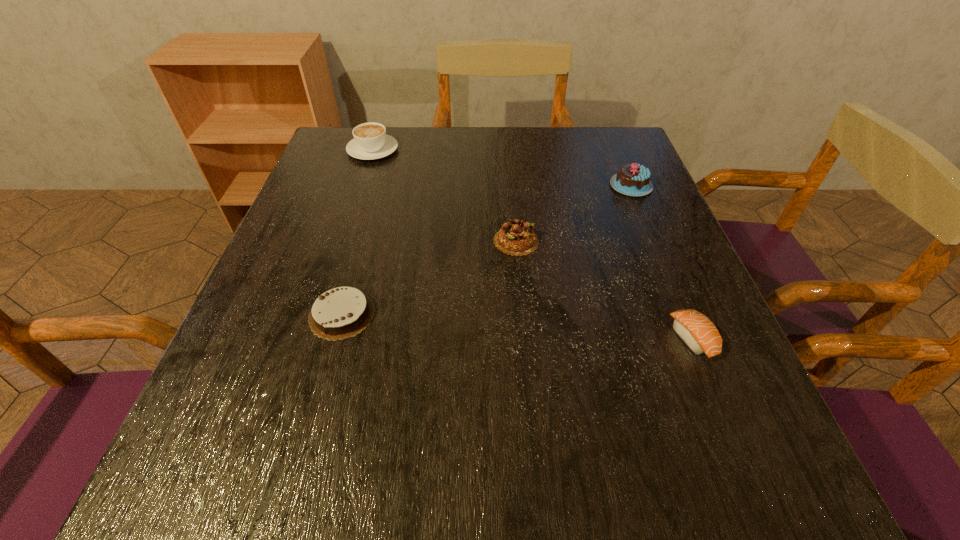
Image resolution: width=960 pixels, height=540 pixels. Identify the location of vacant space located on the front of the sushi. (721, 409).

Locate an element on the screen. free region located 0.200m on the front of the leftmost chocolate cake is located at coordinates (301, 461).

Locate an element on the screen. cappuccino located in the far edge section of the desktop is located at coordinates click(x=370, y=141).

You are a GUI agent. You are given a task and a screenshot of the screen. Output one action in this format:
    pyautogui.click(x=<x>, y=<y>)
    Task: Click on the chocolate cake present at the far edge
    The height and width of the screenshot is (540, 960).
    Given the screenshot: What is the action you would take?
    pyautogui.click(x=632, y=179)

The width and height of the screenshot is (960, 540). In order to click on cappuccino at the left edge in this screenshot , I will do `click(370, 141)`.

Locate an element on the screen. This screenshot has height=540, width=960. chocolate cake at the left edge is located at coordinates (343, 312).

Image resolution: width=960 pixels, height=540 pixels. I want to click on chocolate cake at the right edge, so click(x=632, y=179).

You are a GUI agent. You are given a task and a screenshot of the screen. Output one action in this format:
    pyautogui.click(x=<x>, y=<y>)
    Task: Click on the sushi that is positioned at the right edge
    
    Given the screenshot: What is the action you would take?
    [x=695, y=329]

Image resolution: width=960 pixels, height=540 pixels. What are the coordinates of `object positioned at the far left corner` in the screenshot? It's located at (370, 141).

This screenshot has width=960, height=540. What are the coordinates of `object positioned at the far right corner` in the screenshot? It's located at (632, 179).